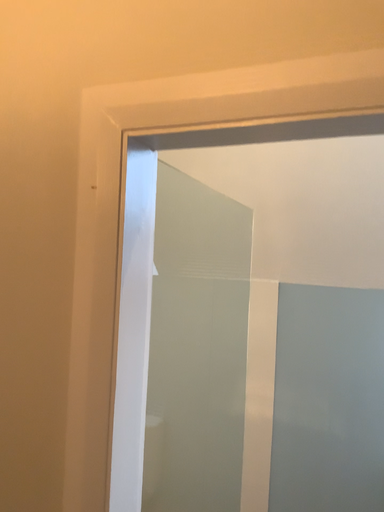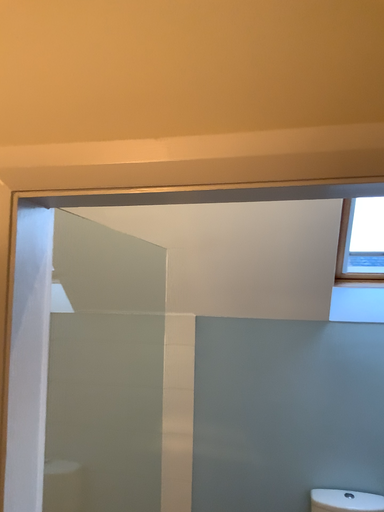
Question: Which way did the camera rotate in the video?

Choices:
 (A) rotated right
 (B) rotated left

Answer: (A)